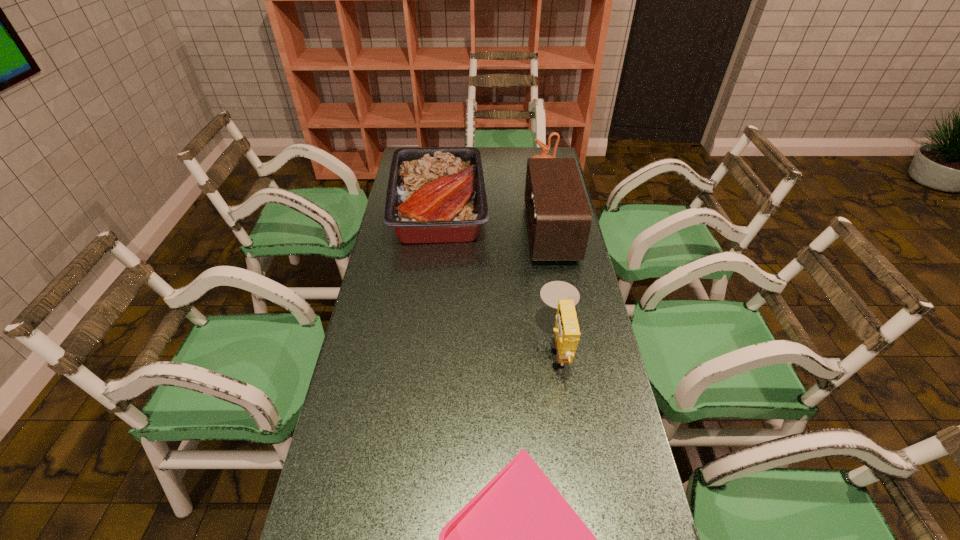
Identify the location of vacant space that satisfies the following two spatial constraints: 1. on the spout of the pottery; 2. on the front side of the second shortest object. This screenshot has height=540, width=960. (548, 207).